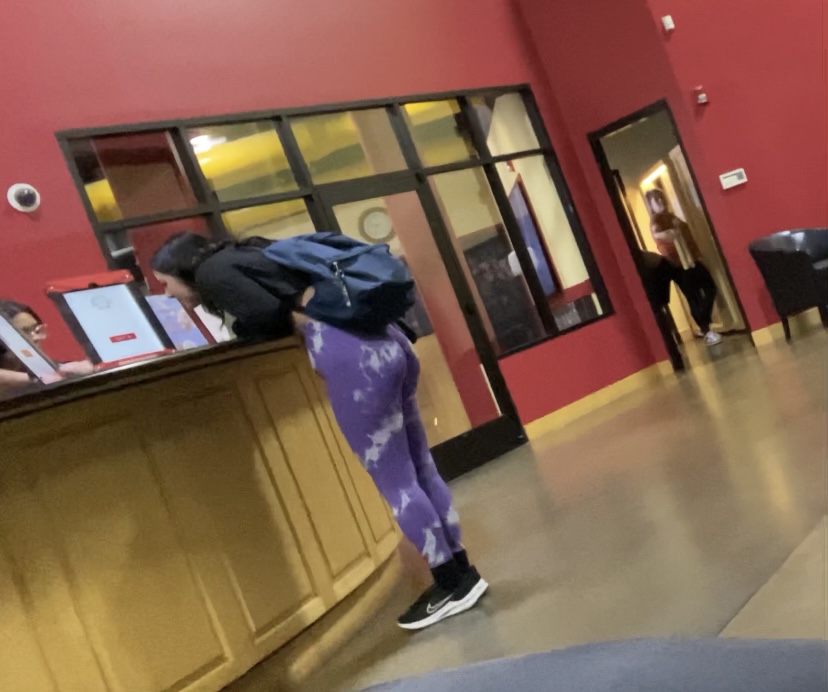
Identify the location of glass door. (395, 233).